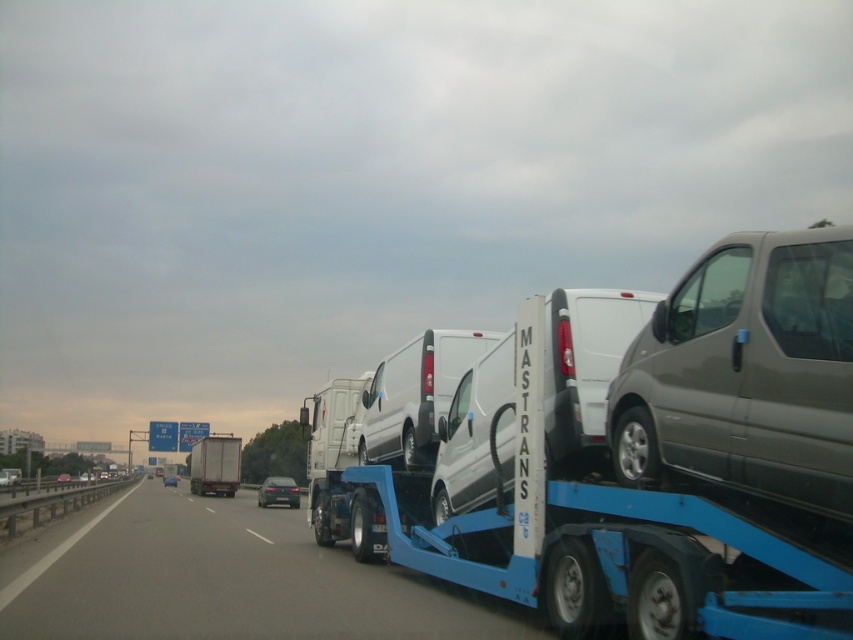
Question: Based on their relative distances, which object is nearer to the matte gray van at right?

Choices:
 (A) blue metallic truck at center
 (B) shiny silver sedan at center
 (C) shiny black sedan at center

Answer: (A)

Question: Does matte gray van at right have a lesser width compared to matte silver truck at center?

Choices:
 (A) no
 (B) yes

Answer: (B)

Question: Which point is closer to the camera?

Choices:
 (A) (264, 488)
 (B) (170, 481)
 (C) (643, 408)

Answer: (C)

Question: Which object is closer to the camera taking this photo?

Choices:
 (A) shiny black sedan at center
 (B) white matte van at center

Answer: (B)

Question: Can you confirm if matte gray van at right is positioned to the right of shiny silver sedan at center?

Choices:
 (A) no
 (B) yes

Answer: (B)

Question: Does matte silver truck at center appear under shiny silver sedan at center?

Choices:
 (A) no
 (B) yes

Answer: (A)